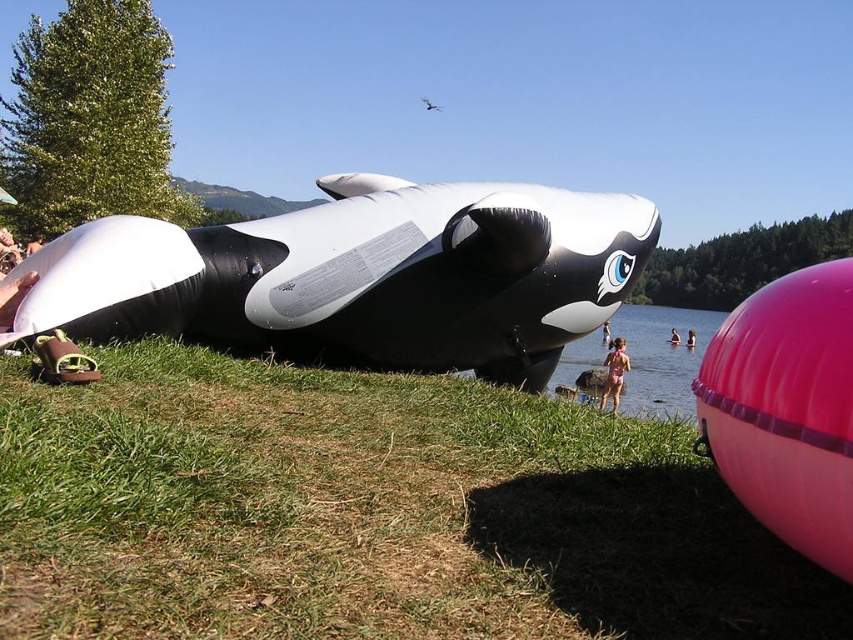
You are standing near the water and see the black rubber whale at center and the pink fabric swimsuit at lower center. Which object is closer to the water?

The black rubber whale at center is to the left of the pink fabric swimsuit at lower center, so the black rubber whale at center is closer to the water.

You are planning to pack a bag for a beach day and have both the pink fabric swimsuit at lower center and the pink rubber ball at lower right. If you want to choose the item that takes up more space in your bag, which one should you pick?

The pink fabric swimsuit at lower center has a larger width than the pink rubber ball at lower right, so it will take up more space in the bag.

You are planning to set up a picnic blanket between the black rubber whale at center and the pink fabric swimsuit at lower center. If the picnic blanket requires 4 meters of space, will there be enough room?

The black rubber whale at center and pink fabric swimsuit at lower center are 5.45 meters apart, so yes, there is enough space to set up the picnic blanket requiring 4 meters of space between them.